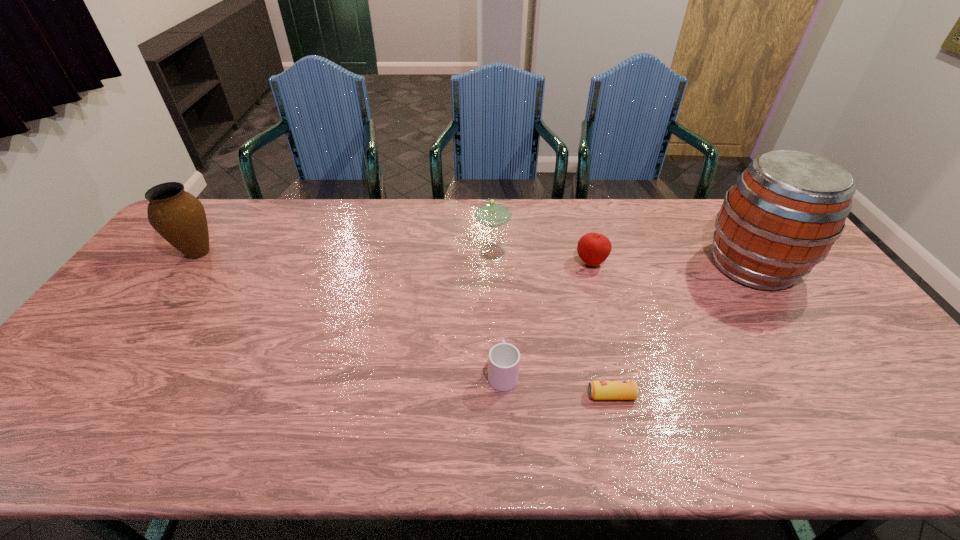
Locate an element on the screen. The height and width of the screenshot is (540, 960). vacant region located on the back of the martini is located at coordinates (493, 220).

Where is `free point located on the back of the apple`? free point located on the back of the apple is located at coordinates (578, 218).

Locate an element on the screen. This screenshot has height=540, width=960. vacant space situated 0.270m with the handle on the side of the cup is located at coordinates (499, 282).

I want to click on vacant area situated with the handle on the side of the cup, so click(x=499, y=292).

Where is `free space located 0.210m with the handle on the side of the cup`? This screenshot has height=540, width=960. free space located 0.210m with the handle on the side of the cup is located at coordinates (499, 296).

Locate an element on the screen. The image size is (960, 540). free spot located on the front of the beer can is located at coordinates (618, 423).

At what (x,y) coordinates should I click in order to perform the action: click on cider situated at the far edge. Please return your answer as a coordinate pair (x, y). Looking at the image, I should click on (786, 210).

Where is `urn positioned at the far edge`? urn positioned at the far edge is located at coordinates (179, 217).

Locate an element on the screen. object present at the left edge is located at coordinates (179, 217).

At what (x,y) coordinates should I click in order to perform the action: click on object present at the right edge. Please return your answer as a coordinate pair (x, y). This screenshot has height=540, width=960. Looking at the image, I should click on click(x=786, y=210).